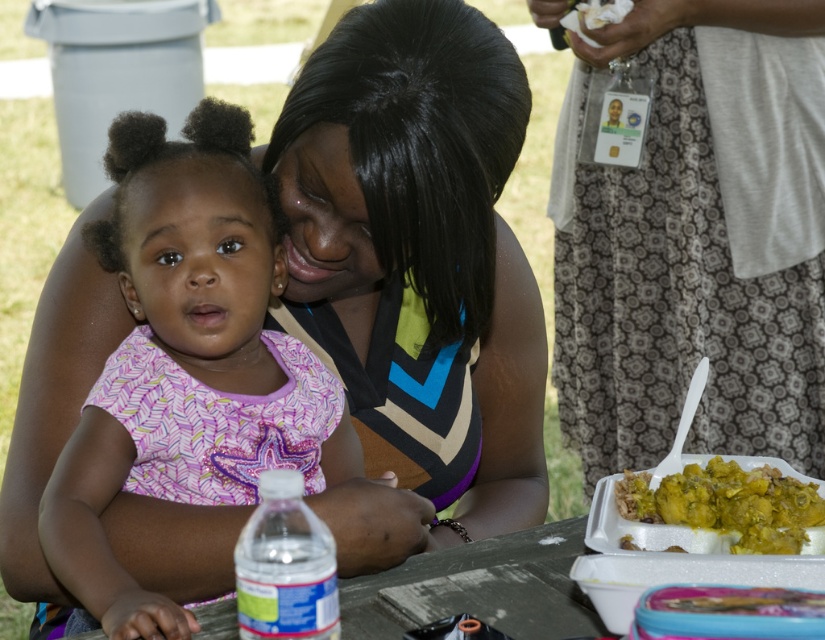
You are standing 1.5 meters away from the picnic table. There is a point at coordinates point [215,115]. Can you reach that point without moving closer to the picnic table?

The distance of point [215,115] from viewer is 1.27 meters, so yes, you can reach that point without moving closer since it is within your current distance of 1.5 meters.